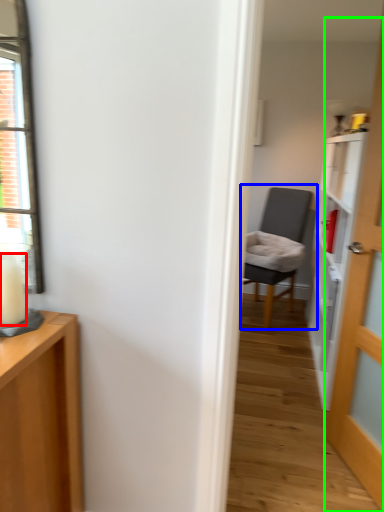
Question: Estimate the real-world distances between objects in this image. Which object is closer to candle (highlighted by a red box), chair (highlighted by a blue box) or door (highlighted by a green box)?

Choices:
 (A) chair
 (B) door

Answer: (B)